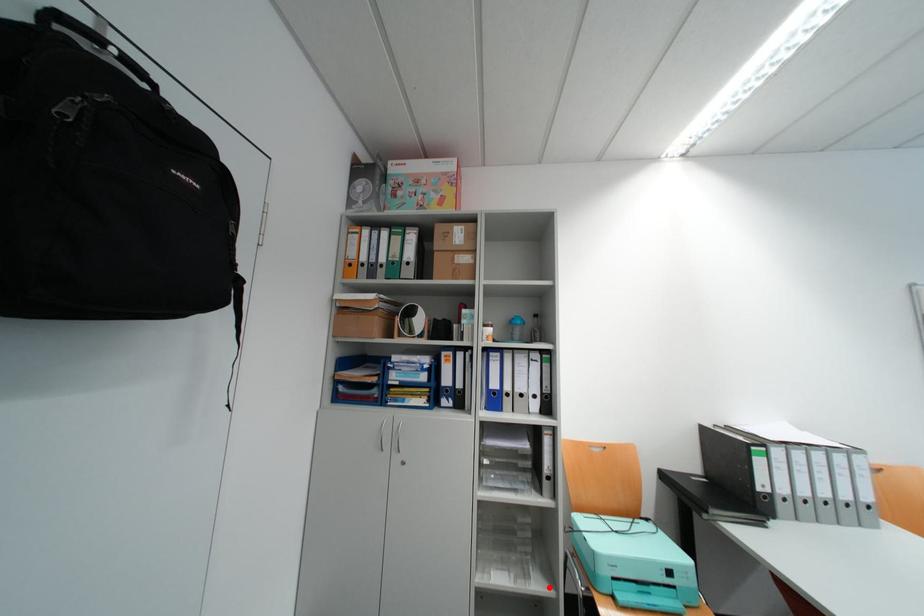
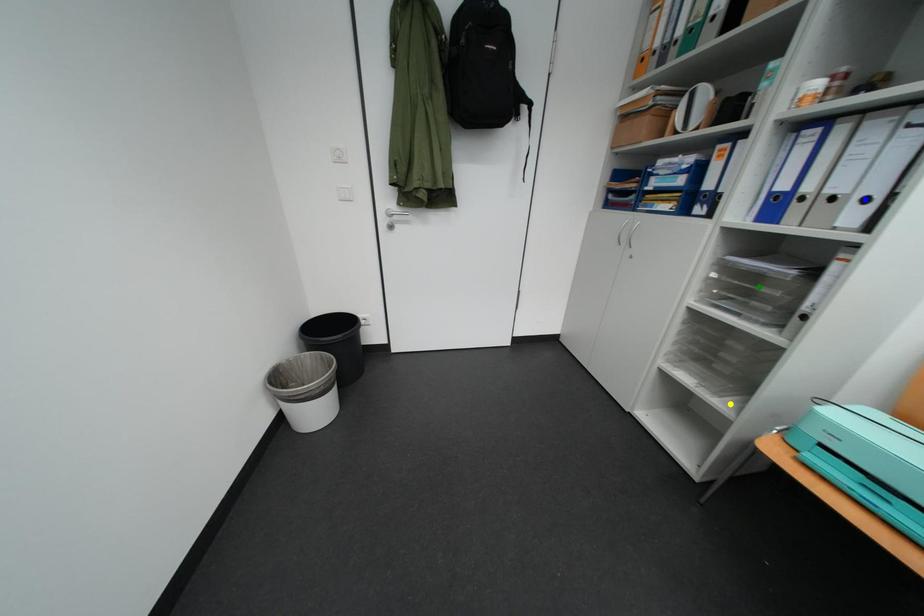
Question: I am providing you with two images of the same scene from different viewpoints. A red point is marked on the first image. You are given multiple points on the second image. Can you choose the point in image 2 that corresponds to the point in image 1?

Choices:
 (A) green point
 (B) yellow point
 (C) blue point

Answer: (B)